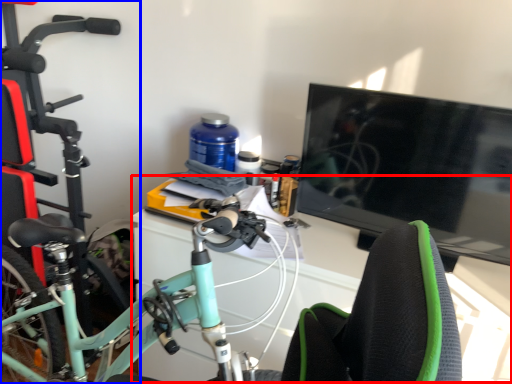
Question: Which of the following is the farthest to the observer, computer desk (highlighted by a red box) or bicycle (highlighted by a blue box)?

Choices:
 (A) computer desk
 (B) bicycle

Answer: (B)